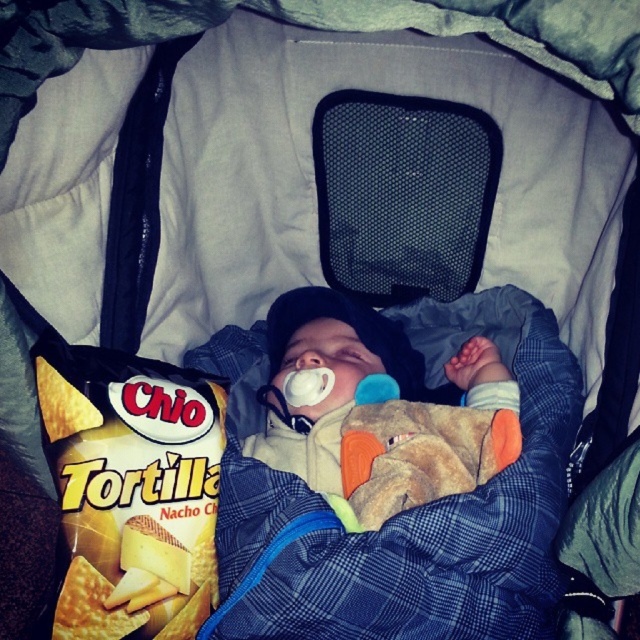
You are a parent holding a baby in a stroller. You want to place a snack on the stroller tray. The snack is a bag of yellow tortilla chips at lower left. Where should you place the bag so it doesn not fall off the tray?

The yellow tortilla chips at lower left should be placed away from the edge of the tray to prevent it from falling off. Since the chips are located at point (132, 490), positioning them towards the center of the tray would be safer.

You are a parent holding a soft plush toy at center. You want to place it closer to your baby without touching the baby. Can you move it 10 inches closer?

The soft plush toy at center is currently 35.20 inches away from the viewer. Moving it 10 inches closer would bring it to 25.20 inches away, which is still a safe distance and possible to do without touching the baby.